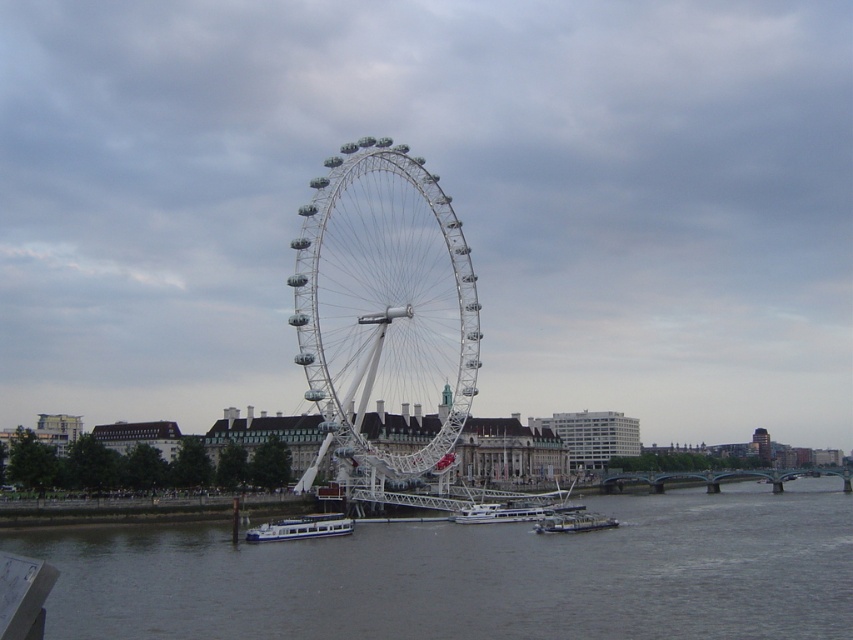
You are standing on the bank of the River Thames and see the white metallic ferris wheel at center and the metallic gray barge at lower center. Which object is taller?

The white metallic ferris wheel at center is taller than the metallic gray barge at lower center.

You are standing on the observation deck of the white metallic ferris wheel at center. You want to take a photo of the white glossy boat at lower left. Is the boat within your camera lens field of view? Assume your camera has a 50mm lens and you are 137.21 feet away from the boat.

The distance between the white metallic ferris wheel at center and the white glossy boat at lower left is 137.21 feet. With a 50mm lens, the field of view at that distance can capture objects within approximately 30 feet of the center point. Since the boat is exactly at the 137.21 feet distance, it might be at the edge of the field of view but likely still visible. However, precise framing would depend on the exact angle and zoom level.

You are standing at the point marked as point (476, 573). What is located at this position?

The gray water at lower center is located at point (476, 573).